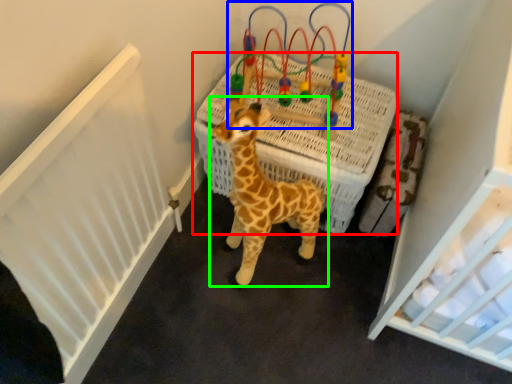
Question: Considering the real-world distances, which object is farthest from infant bed (highlighted by a red box)? toy (highlighted by a blue box) or giraffe (highlighted by a green box)?

Choices:
 (A) toy
 (B) giraffe

Answer: (B)